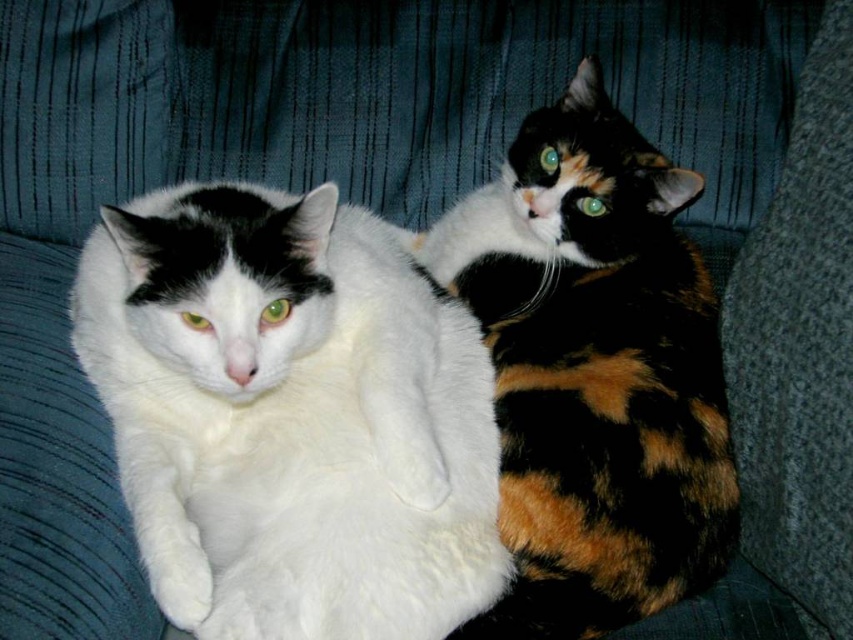
Image resolution: width=853 pixels, height=640 pixels. What do you see at coordinates (289, 416) in the screenshot? I see `white fluffy cat at left` at bounding box center [289, 416].

Does white fluffy cat at left have a lesser width compared to calico fur cat at right?

No, white fluffy cat at left is not thinner than calico fur cat at right.

Is point (354, 532) more distant than point (645, 209)?

No, it is not.

The width and height of the screenshot is (853, 640). In order to click on white fluffy cat at left in this screenshot , I will do `click(289, 416)`.